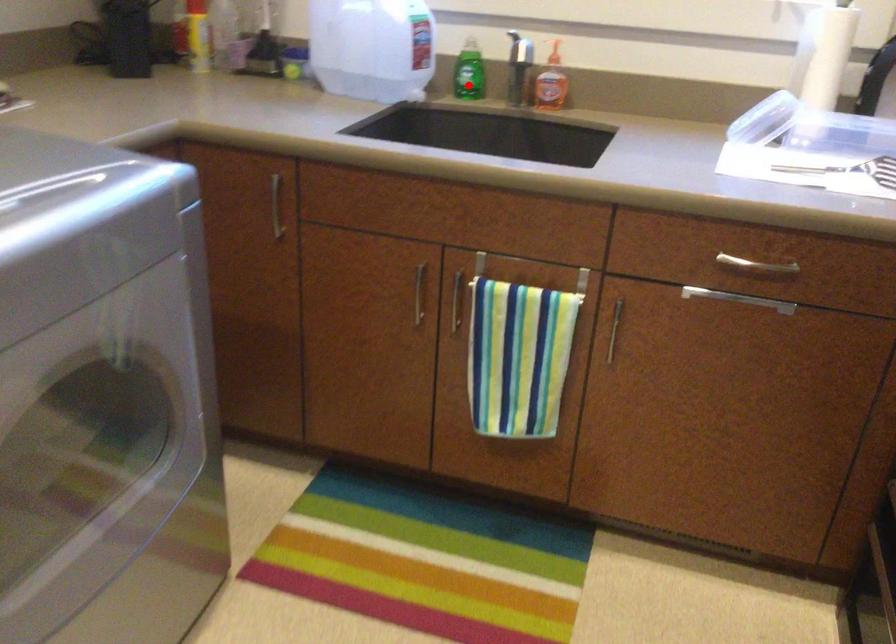
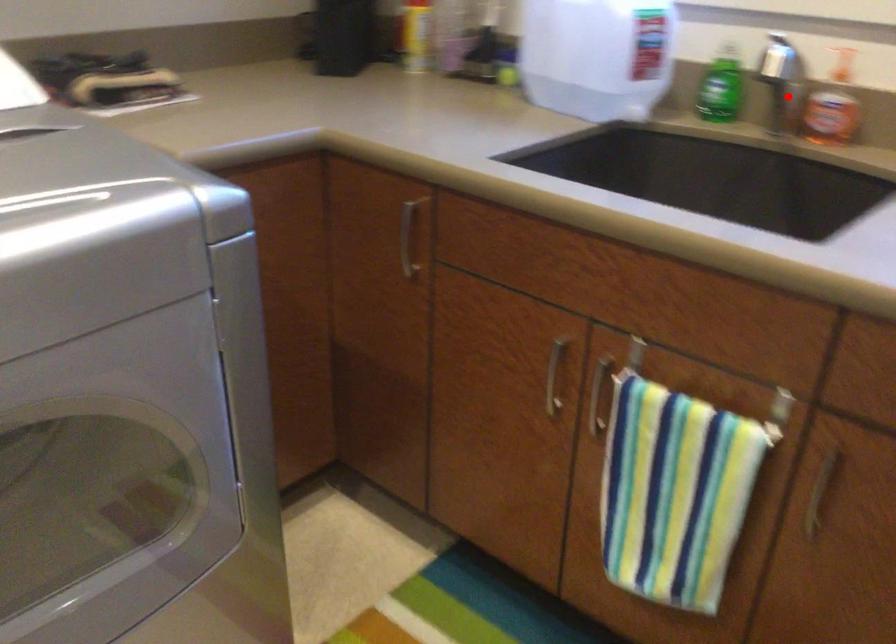
I am providing you with two images of the same scene from different viewpoints. A red point is marked on the first image and another point is marked on the second image. Do the highlighted points in image1 and image2 indicate the same real-world spot?

No